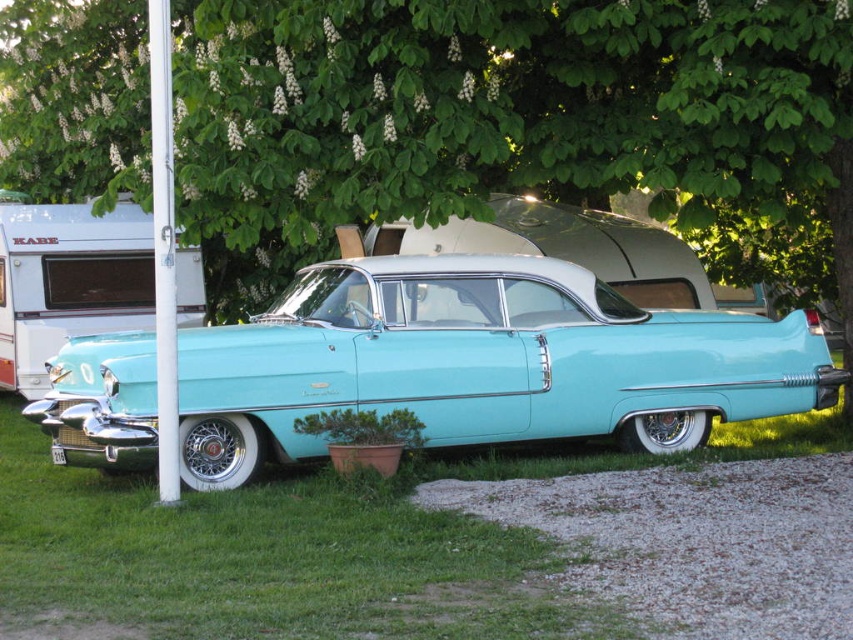
You are standing in front of the vintage car and want to take a photo of both the green leafy tree at upper center and the metallic silver trailer at left. Which object should you position to your left side to include both in the frame?

To include both the green leafy tree at upper center and the metallic silver trailer at left in the frame, position the metallic silver trailer at left to your left side since the green leafy tree at upper center is to the right of the metallic silver trailer at left.

Based on the photo, you are a photographer planning to take a picture of the vintage car parked under the green leafy tree at upper center. To ensure the tree is centered in the frame, where should you position your camera relative to the car?

The green leafy tree at upper center is located at coordinates point (521, 120), so you should position your camera slightly to the left and lower than the center to center the tree in the frame.

You are planning to park your vehicle in a parking spot that can only accommodate vehicles up to the size of the metallic silver trailer at left. Can the light blue glossy car at center fit in this parking spot?

The light blue glossy car at center is wider than the metallic silver trailer at left, so it cannot fit into the parking spot designed for the trailer.